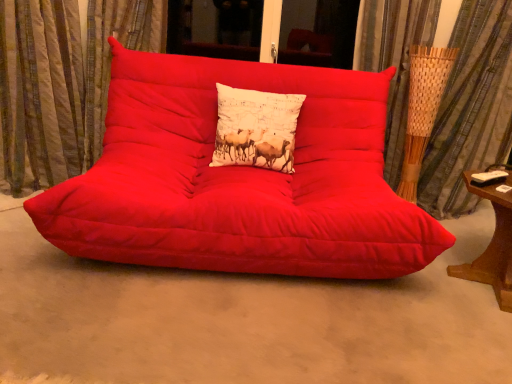
Question: From the image's perspective, is white cotton cushion at center located above matte red studio couch at center?

Choices:
 (A) no
 (B) yes

Answer: (B)

Question: Considering the relative sizes of white cotton cushion at center and matte red studio couch at center in the image provided, is white cotton cushion at center bigger than matte red studio couch at center?

Choices:
 (A) no
 (B) yes

Answer: (A)

Question: Could you tell me if white cotton cushion at center is turned towards matte red studio couch at center?

Choices:
 (A) yes
 (B) no

Answer: (A)

Question: Is matte red studio couch at center at the back of white cotton cushion at center?

Choices:
 (A) yes
 (B) no

Answer: (A)

Question: From a real-world perspective, is white cotton cushion at center below matte red studio couch at center?

Choices:
 (A) no
 (B) yes

Answer: (A)

Question: Looking at the image, does matte red studio couch at center seem bigger or smaller compared to woven bamboo curtain at right, the 1th curtain viewed from the right?

Choices:
 (A) small
 (B) big

Answer: (B)

Question: Is point (294, 258) closer or farther from the camera than point (493, 160)?

Choices:
 (A) closer
 (B) farther

Answer: (A)

Question: Looking at their shapes, would you say matte red studio couch at center is wider or thinner than woven bamboo curtain at right, the second curtain when ordered from left to right?

Choices:
 (A) thin
 (B) wide

Answer: (B)

Question: From their relative heights in the image, would you say matte red studio couch at center is taller or shorter than woven bamboo curtain at right, the 1th curtain viewed from the right?

Choices:
 (A) tall
 (B) short

Answer: (B)

Question: In terms of width, does matte red studio couch at center look wider or thinner when compared to matte red futon at center?

Choices:
 (A) thin
 (B) wide

Answer: (A)

Question: Is point (276, 208) positioned closer to the camera than point (351, 329)?

Choices:
 (A) closer
 (B) farther

Answer: (B)

Question: From the image's perspective, relative to matte red futon at center, is matte red studio couch at center above or below?

Choices:
 (A) below
 (B) above

Answer: (B)

Question: Based on their positions, is matte red studio couch at center located to the left or right of matte red futon at center?

Choices:
 (A) right
 (B) left

Answer: (B)

Question: From a real-world perspective, relative to matte red studio couch at center, is white cotton cushion at center vertically above or below?

Choices:
 (A) above
 (B) below

Answer: (A)

Question: In terms of width, does white cotton cushion at center look wider or thinner when compared to matte red studio couch at center?

Choices:
 (A) wide
 (B) thin

Answer: (B)